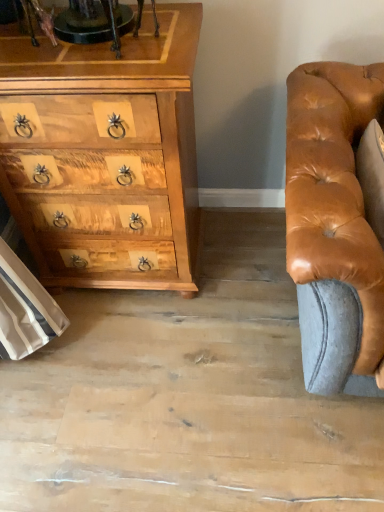
I want to click on blank space situated above natural wood chest of drawers at left (from a real-world perspective), so click(93, 34).